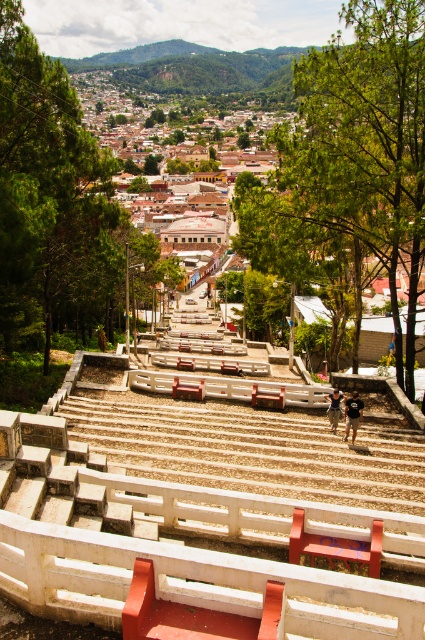
Does point (371, 211) come closer to viewer compared to point (53, 80)?

No, it is not.

The image size is (425, 640). Identify the location of green leafy tree at upper center. (365, 147).

Find the location of a particular element. This screenshot has width=425, height=640. green leafy tree at upper center is located at coordinates (365, 147).